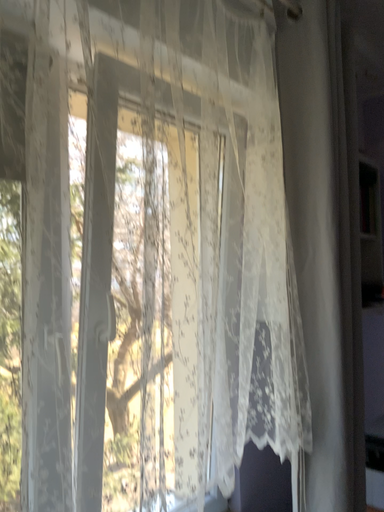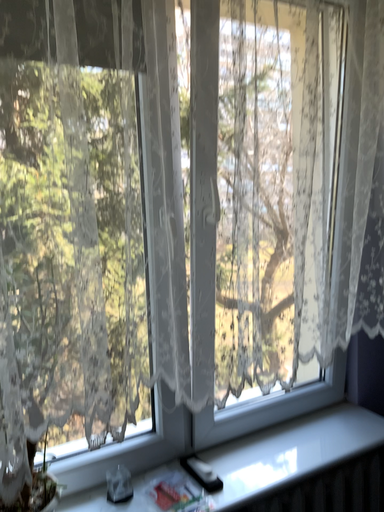
Question: How did the camera likely rotate when shooting the video?

Choices:
 (A) rotated downward
 (B) rotated upward

Answer: (A)